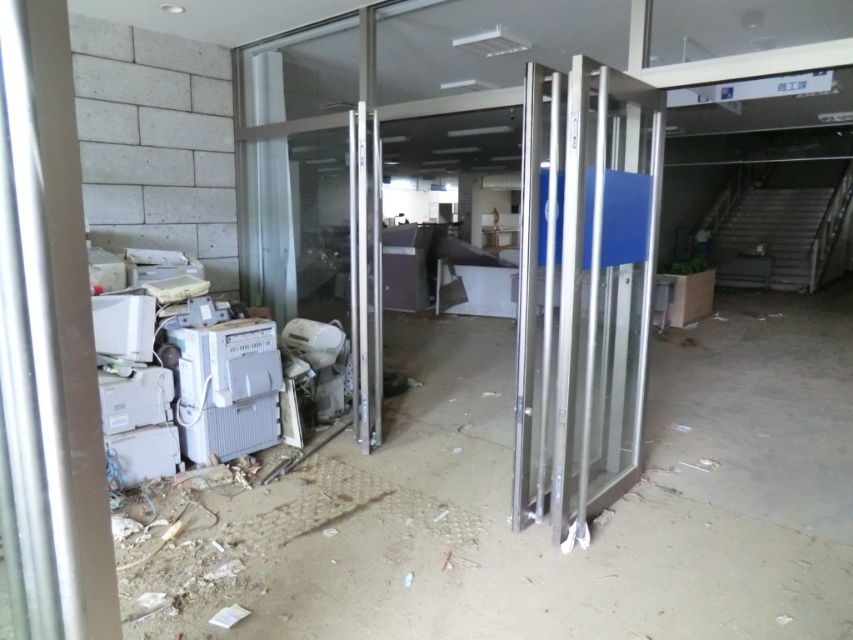
Does metallic gray electronics at lower left have a greater width compared to polished silver glass door at center?

Yes, metallic gray electronics at lower left is wider than polished silver glass door at center.

Image resolution: width=853 pixels, height=640 pixels. Describe the element at coordinates (543, 524) in the screenshot. I see `metallic gray electronics at lower left` at that location.

The height and width of the screenshot is (640, 853). I want to click on metallic gray electronics at lower left, so click(543, 524).